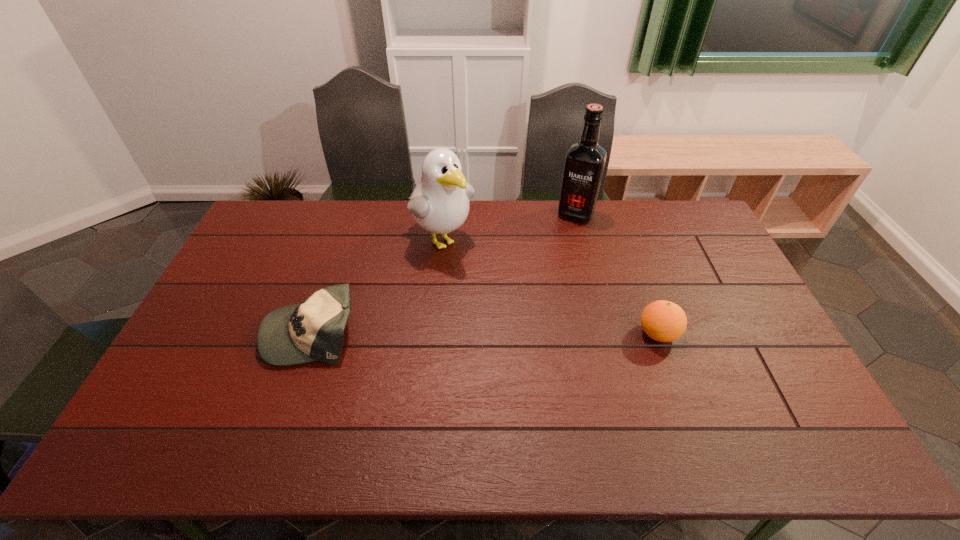
At what (x,y) coordinates should I click in order to perform the action: click on vacant area that lies between the third object from right to left and the orange. Please return your answer as a coordinate pair (x, y). This screenshot has height=540, width=960. Looking at the image, I should click on (549, 286).

You are a GUI agent. You are given a task and a screenshot of the screen. Output one action in this format:
    pyautogui.click(x=<x>, y=<y>)
    Task: Click on the free space between the third object from right to left and the baseball cap
    Image resolution: width=960 pixels, height=540 pixels.
    Given the screenshot: What is the action you would take?
    pyautogui.click(x=376, y=285)

The width and height of the screenshot is (960, 540). I want to click on object that stands as the third closest to the baseball cap, so click(664, 321).

Locate an element on the screen. The height and width of the screenshot is (540, 960). object that is the third closest to the third shortest object is located at coordinates (664, 321).

Identify the location of free space that satisfies the following two spatial constraints: 1. on the front side of the third object from left to right; 2. on the left side of the rightmost object. (606, 334).

You are a GUI agent. You are given a task and a screenshot of the screen. Output one action in this format:
    pyautogui.click(x=<x>, y=<y>)
    Task: Click on the vacant space that satisfies the following two spatial constraints: 1. on the front side of the second object from right to left; 2. on the right side of the orange
    The width and height of the screenshot is (960, 540).
    Given the screenshot: What is the action you would take?
    pyautogui.click(x=606, y=334)